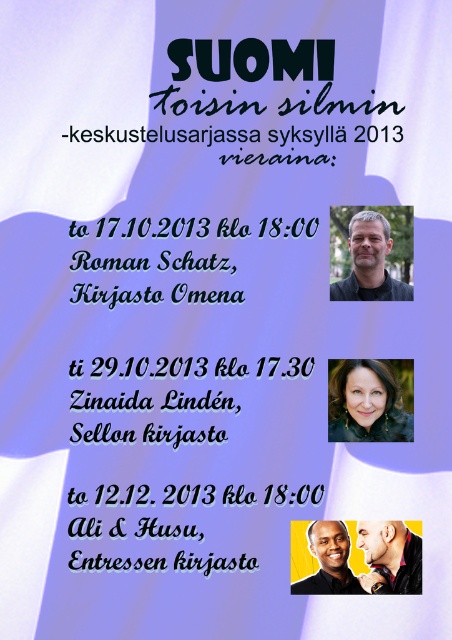
Question: Can you confirm if black paper text at upper center is positioned to the right of matte black portrait at upper center?

Choices:
 (A) yes
 (B) no

Answer: (B)

Question: Based on their relative distances, which object is nearer to the smooth black face at upper center?

Choices:
 (A) smooth skin face at center
 (B) matte black portrait at upper center
 (C) smooth black hair at center

Answer: (A)

Question: Which object is the closest to the smooth skin face at center?

Choices:
 (A) matte black portrait at upper center
 (B) smooth black hair at center

Answer: (B)

Question: Can you confirm if black paper text at upper center is positioned below smooth black face at upper center?

Choices:
 (A) no
 (B) yes

Answer: (A)

Question: Which point appears farthest from the camera in this image?

Choices:
 (A) (365, 548)
 (B) (70, 268)
 (C) (344, 573)
 (D) (361, 369)

Answer: (D)

Question: Does black paper text at upper center lie behind smooth skin face at center?

Choices:
 (A) yes
 (B) no

Answer: (A)